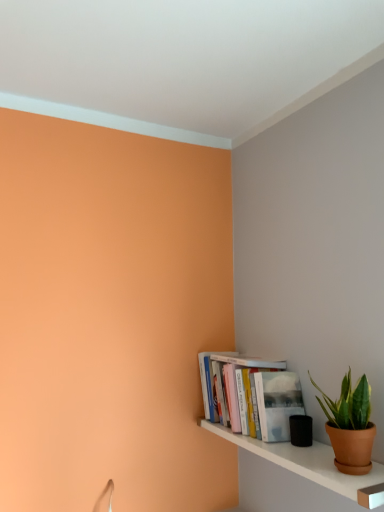
The width and height of the screenshot is (384, 512). Identify the location of free point behind green matte plant pot at lower right. pyautogui.click(x=299, y=450).